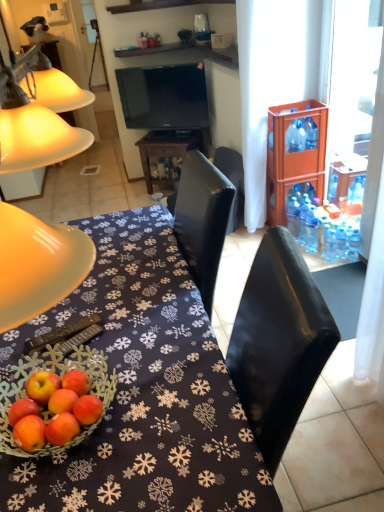
Question: Is black glossy table at center thinner than clear plastic bottle at right, positioned as the first bottle in left-to-right order?

Choices:
 (A) no
 (B) yes

Answer: (A)

Question: Is black glossy table at center not within clear plastic bottle at right, positioned as the first bottle in left-to-right order?

Choices:
 (A) no
 (B) yes

Answer: (B)

Question: Is black glossy table at center to the left of clear plastic bottle at right, which appears as the 2th bottle when ordered from the bottom, from the viewer's perspective?

Choices:
 (A) no
 (B) yes

Answer: (B)

Question: Is clear plastic bottle at right, acting as the third bottle starting from the right, at the back of black glossy table at center?

Choices:
 (A) no
 (B) yes

Answer: (A)

Question: From the image's perspective, is black glossy table at center beneath clear plastic bottle at right, acting as the third bottle starting from the right?

Choices:
 (A) yes
 (B) no

Answer: (B)

Question: Which is correct: black glossy television at upper center is inside clear plastic bottle at right, which ranks as the first bottle in bottom-to-top order, or outside of it?

Choices:
 (A) inside
 (B) outside

Answer: (B)

Question: From a real-world perspective, relative to clear plastic bottle at right, placed as the first bottle when sorted from right to left, is black glossy television at upper center vertically above or below?

Choices:
 (A) above
 (B) below

Answer: (A)

Question: Does point (160, 118) appear closer or farther from the camera than point (354, 248)?

Choices:
 (A) farther
 (B) closer

Answer: (A)

Question: From their relative heights in the image, would you say black glossy television at upper center is taller or shorter than clear plastic bottle at right, placed as the first bottle when sorted from right to left?

Choices:
 (A) short
 (B) tall

Answer: (B)

Question: Is point (314, 133) closer or farther from the camera than point (92, 138)?

Choices:
 (A) closer
 (B) farther

Answer: (B)

Question: From a real-world perspective, is blue plastic bottle at right, the second bottle when ordered from left to right, physically located above or below matte yellow lampshade at left?

Choices:
 (A) above
 (B) below

Answer: (A)

Question: From their relative heights in the image, would you say blue plastic bottle at right, which appears as the 1th bottle when viewed from the top, is taller or shorter than matte yellow lampshade at left?

Choices:
 (A) short
 (B) tall

Answer: (A)

Question: Is blue plastic bottle at right, the 3th bottle ordered from the bottom, inside or outside of matte yellow lampshade at left?

Choices:
 (A) inside
 (B) outside

Answer: (B)

Question: Based on their positions, is blue plastic bottle at right, the 2th bottle in the right-to-left sequence, located to the left or right of black leather chair at center?

Choices:
 (A) right
 (B) left

Answer: (A)

Question: Relative to black leather chair at center, is blue plastic bottle at right, the second bottle when ordered from left to right, in front or behind?

Choices:
 (A) front
 (B) behind

Answer: (A)